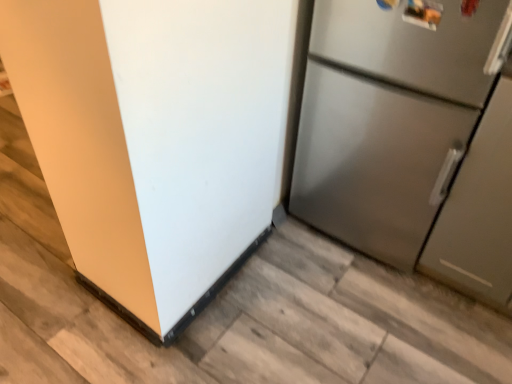
Question: Based on their sizes in the image, would you say satin silver refrigerator at right, acting as the 1th refrigerator starting from the right, is bigger or smaller than stainless steel refrigerator at right, the second refrigerator in the right-to-left sequence?

Choices:
 (A) big
 (B) small

Answer: (A)

Question: Visually, is satin silver refrigerator at right, placed as the second refrigerator when sorted from left to right, positioned to the left or to the right of stainless steel refrigerator at right, positioned as the 1th refrigerator in left-to-right order?

Choices:
 (A) left
 (B) right

Answer: (B)

Question: Is satin silver refrigerator at right, placed as the second refrigerator when sorted from left to right, in front of or behind stainless steel refrigerator at right, the second refrigerator in the right-to-left sequence, in the image?

Choices:
 (A) behind
 (B) front

Answer: (A)

Question: Is stainless steel refrigerator at right, the second refrigerator in the right-to-left sequence, inside the boundaries of satin silver refrigerator at right, placed as the second refrigerator when sorted from left to right, or outside?

Choices:
 (A) outside
 (B) inside

Answer: (A)

Question: Is point (208, 119) closer or farther from the camera than point (451, 284)?

Choices:
 (A) closer
 (B) farther

Answer: (A)

Question: In terms of width, does stainless steel refrigerator at right, positioned as the 1th refrigerator in left-to-right order, look wider or thinner when compared to satin silver refrigerator at right, acting as the 1th refrigerator starting from the right?

Choices:
 (A) wide
 (B) thin

Answer: (A)

Question: Based on their positions, is stainless steel refrigerator at right, the second refrigerator in the right-to-left sequence, located to the left or right of satin silver refrigerator at right, placed as the second refrigerator when sorted from left to right?

Choices:
 (A) right
 (B) left

Answer: (B)